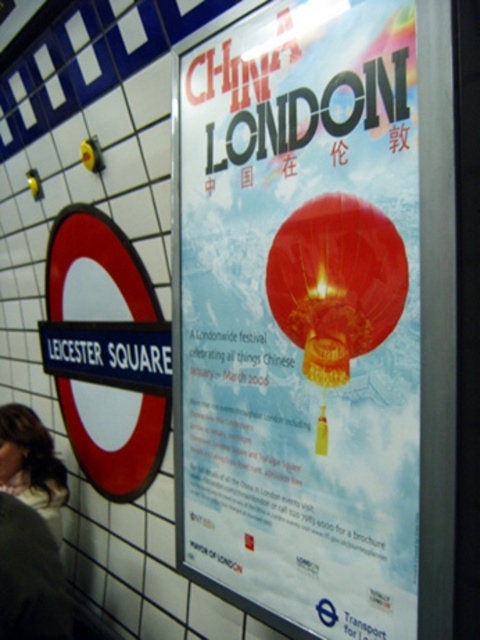
Does metallic round sign at left come behind blonde hair at lower left?

No, it is not.

Which is in front, point (96, 433) or point (15, 403)?

Point (96, 433) is more forward.

Find the location of a particular element. The height and width of the screenshot is (640, 480). metallic round sign at left is located at coordinates (95, 269).

Between matte red poster at upper right and metallic round sign at left, which one has less height?

metallic round sign at left

Who is more forward, (394, 580) or (106, 417)?

Point (394, 580)

Identify the location of matte red poster at upper right. The image size is (480, 640). (300, 317).

Is matte red poster at upper right wider than blonde hair at lower left?

Indeed, matte red poster at upper right has a greater width compared to blonde hair at lower left.

Who is lower down, matte red poster at upper right or blonde hair at lower left?

blonde hair at lower left

I want to click on matte red poster at upper right, so click(x=300, y=317).